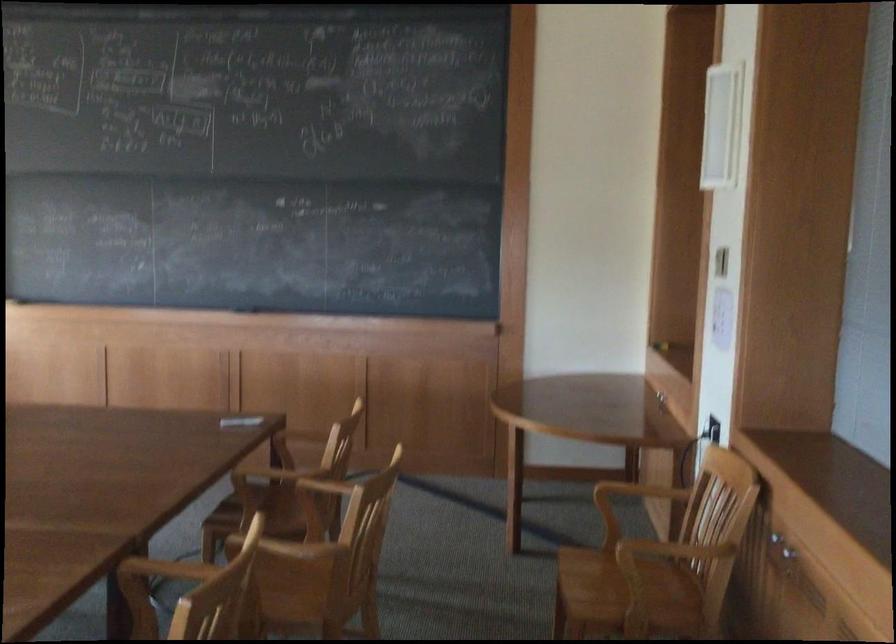
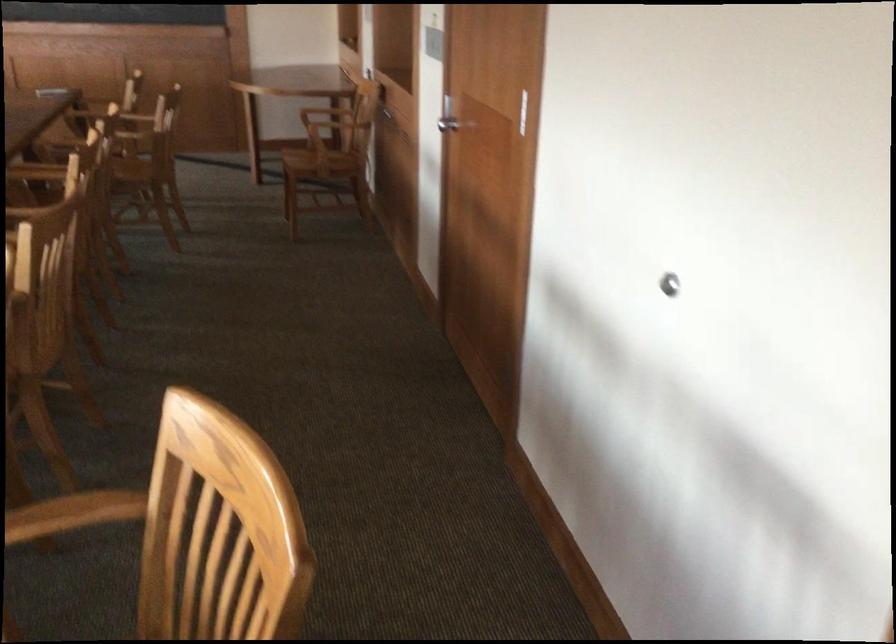
Question: I am providing you with two images of the same scene from different viewpoints. Which of the following objects are not visible in image2?

Choices:
 (A) silver cabinet knob
 (B) blue litter box cover
 (C) silver wall stop
 (D) chair armrest

Answer: (A)